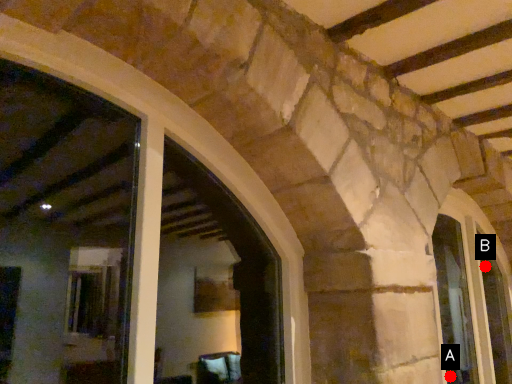
Question: Two points are circled on the image, labeled by A and B beside each circle. Which point is closer to the camera?

Choices:
 (A) A is closer
 (B) B is closer

Answer: (A)